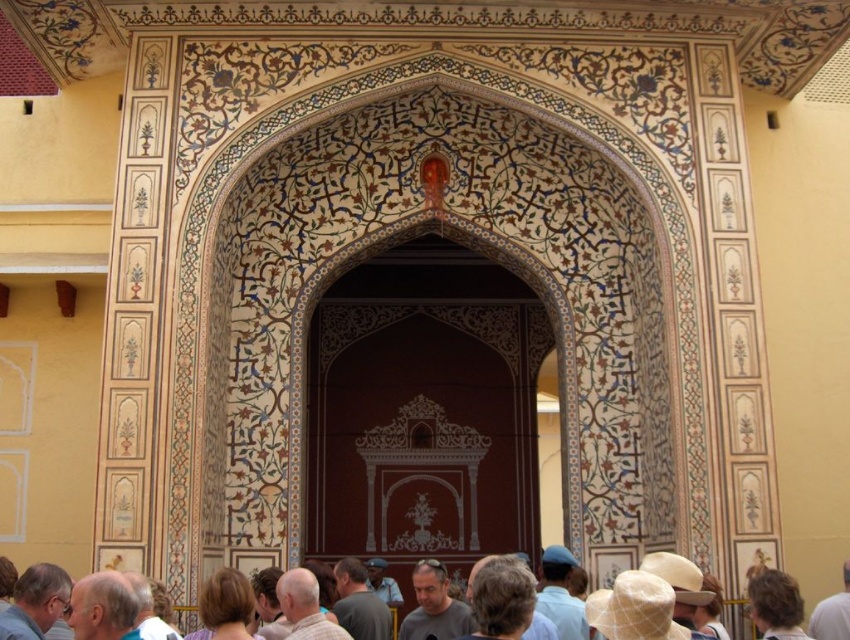
Is gray fabric head at center positioned behind gray fabric shirt at center?

No.

Between gray fabric head at center and gray fabric shirt at center, which one has less height?

gray fabric shirt at center

Which is behind, point (429, 600) or point (340, 618)?

The point (429, 600) is more distant.

Find the location of a particular element. The height and width of the screenshot is (640, 850). gray fabric head at center is located at coordinates (434, 605).

Between point (204, 598) and point (387, 616), which one is positioned behind?

The point (387, 616) is behind.

Does blonde hair at center have a lesser width compared to gray fabric shirt at center?

Indeed, blonde hair at center has a lesser width compared to gray fabric shirt at center.

The height and width of the screenshot is (640, 850). I want to click on blonde hair at center, so click(x=225, y=605).

Does brown hair at lower center lie in front of blue fabric hat at lower center?

Yes.

Which is below, brown hair at lower center or blue fabric hat at lower center?

Positioned lower is blue fabric hat at lower center.

Who is more forward, (520, 582) or (568, 609)?

Point (520, 582) is in front.

Find the location of `brown hair at lower center`. brown hair at lower center is located at coordinates (500, 598).